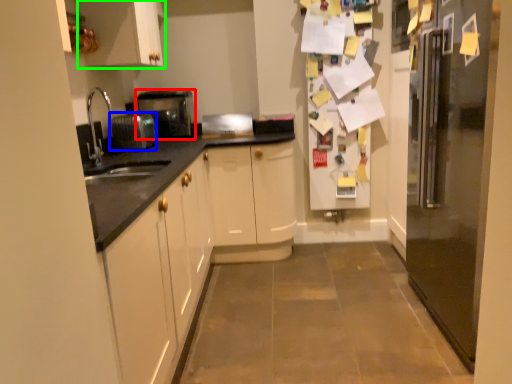
Question: Based on their relative distances, which object is nearer to home appliance (highlighted by a red box)? Choose from appliance (highlighted by a blue box) and cabinetry (highlighted by a green box).

Choices:
 (A) appliance
 (B) cabinetry

Answer: (A)